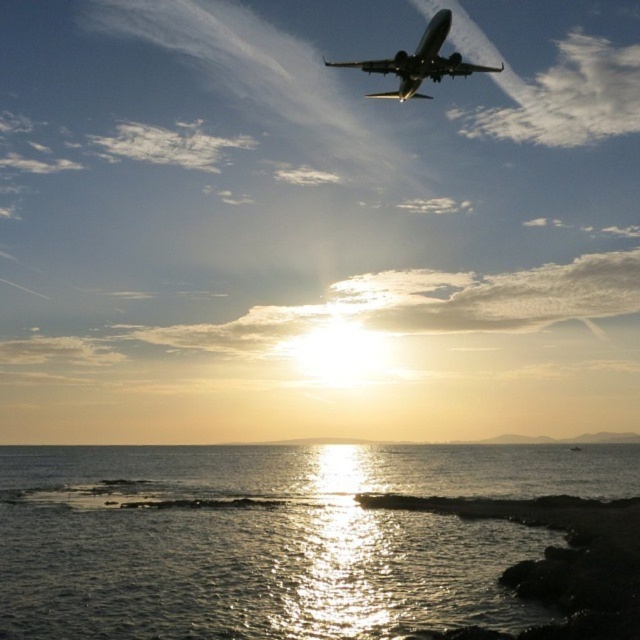
Question: Is shiny reflective water at lower center bigger than metallic silver airplane at upper center?

Choices:
 (A) no
 (B) yes

Answer: (A)

Question: In this image, where is shiny reflective water at lower center located relative to metallic silver airplane at upper center?

Choices:
 (A) right
 (B) left

Answer: (B)

Question: Is shiny reflective water at lower center thinner than metallic silver airplane at upper center?

Choices:
 (A) yes
 (B) no

Answer: (B)

Question: Which point is closer to the camera?

Choices:
 (A) (445, 61)
 (B) (305, 468)

Answer: (A)